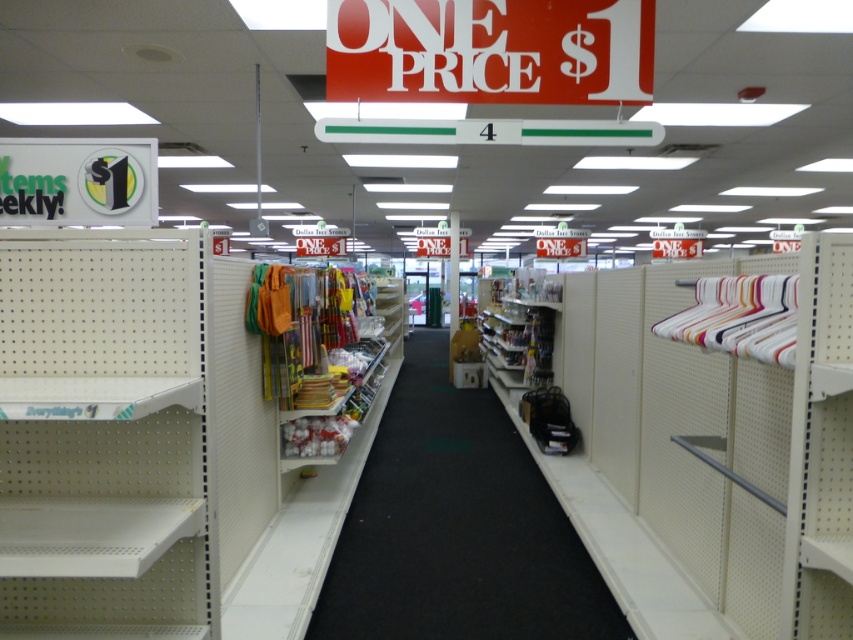
Question: Can you confirm if white plastic shelves at center is positioned above red plastic sign at upper center?

Choices:
 (A) yes
 (B) no

Answer: (B)

Question: Does white matte shelf at left come in front of red plastic sign at upper center?

Choices:
 (A) no
 (B) yes

Answer: (B)

Question: Which point appears closest to the camera in this image?

Choices:
 (A) (550, 12)
 (B) (814, 269)
 (C) (415, 544)

Answer: (B)

Question: Which object is closer to the camera taking this photo?

Choices:
 (A) white matte shelf at right
 (B) white plastic shelves at center
 (C) red plastic sign at upper center
 (D) white matte shelf at left

Answer: (D)

Question: Which point is farther from the camera taking this photo?

Choices:
 (A) (628, 467)
 (B) (502, 634)
 (C) (428, 28)

Answer: (A)

Question: Can you confirm if white matte shelf at right is positioned to the left of white matte shelf at left?

Choices:
 (A) yes
 (B) no

Answer: (B)